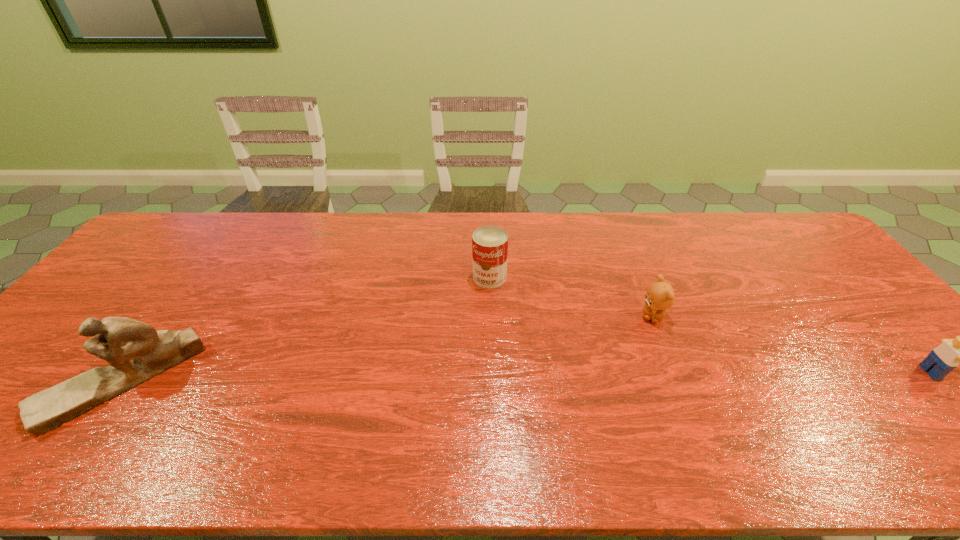
What are the coordinates of `free point between the can and the second object from right to left` in the screenshot? It's located at pyautogui.click(x=571, y=297).

Find the location of a particular element. Image resolution: width=960 pixels, height=540 pixels. free area in between the second farthest object and the can is located at coordinates (571, 297).

Identify the location of free space between the tallest object and the farthest object. (305, 329).

I want to click on free area in between the tallest object and the second tallest object, so click(305, 329).

Find the location of a particular element. This screenshot has width=960, height=540. object that is the closest to the second tallest object is located at coordinates (660, 295).

Point out which object is positioned as the nearest to the rightmost object. Please provide its 2D coordinates. Your answer should be formatted as a tuple, i.e. [(x, y)], where the tuple contains the x and y coordinates of a point satisfying the conditions above.

[(660, 295)]

The width and height of the screenshot is (960, 540). I want to click on free spot that satisfies the following two spatial constraints: 1. on the front side of the third object from left to right; 2. on the right side of the can, so click(x=491, y=317).